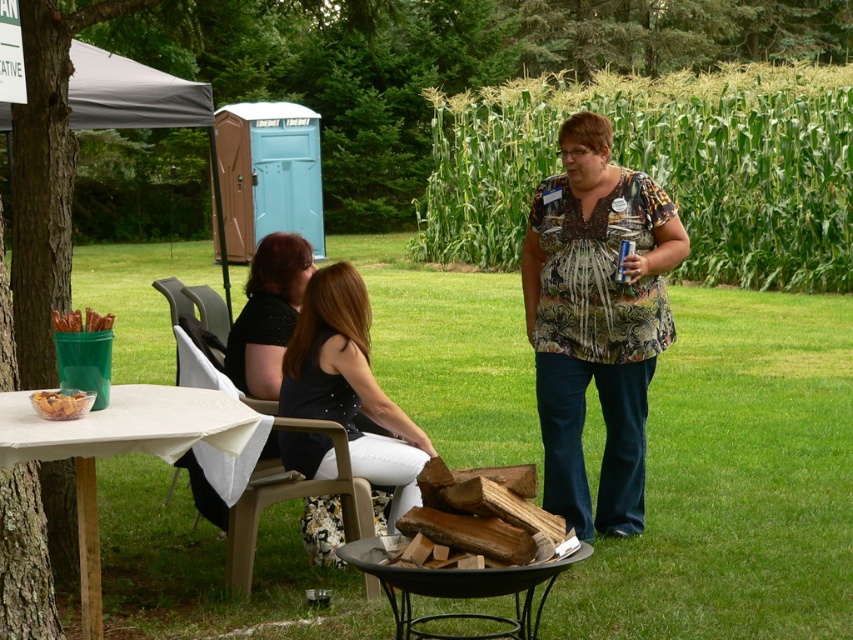
Question: Is green leafy corn at upper right behind printed fabric blouse at center?

Choices:
 (A) yes
 (B) no

Answer: (A)

Question: Which point is farther to the camera?

Choices:
 (A) (570, 182)
 (B) (102, 324)
 (C) (492, 161)
 (D) (120, 429)

Answer: (C)

Question: Does black fabric dress at center appear under wooden firewood at center?

Choices:
 (A) no
 (B) yes

Answer: (A)

Question: Which object appears farthest from the camera in this image?

Choices:
 (A) white cloth-covered table at lower left
 (B) wooden firewood at center
 (C) printed fabric blouse at center

Answer: (C)

Question: Which point is closer to the camera taking this photo?

Choices:
 (A) (462, 596)
 (B) (252, 429)
 (C) (68, 316)

Answer: (B)

Question: Does white cloth-covered table at lower left appear under golden crispy chips at lower left?

Choices:
 (A) no
 (B) yes

Answer: (B)